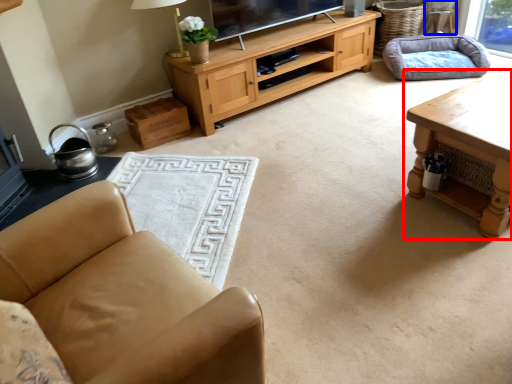
Question: Which of the following is the closest to the observer, table (highlighted by a red box) or armchair (highlighted by a blue box)?

Choices:
 (A) table
 (B) armchair

Answer: (A)